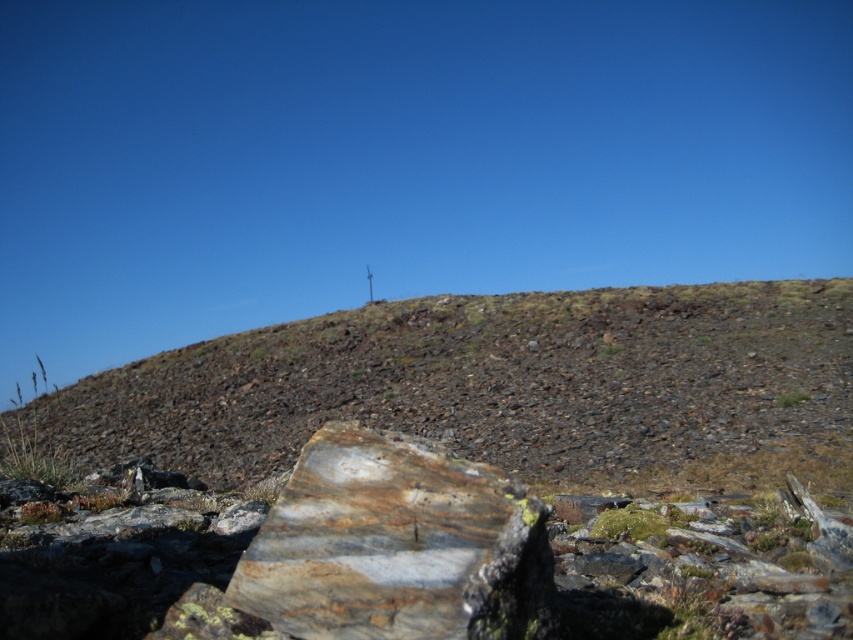
Is point (556, 436) closer to camera compared to point (422, 611)?

No.

Who is more distant from viewer, (676, 404) or (393, 568)?

The point (676, 404) is more distant.

At what (x,y) coordinates should I click in order to perform the action: click on rusty stone hillside at upper center. Please return your answer as a coordinate pair (x, y). Looking at the image, I should click on (486, 384).